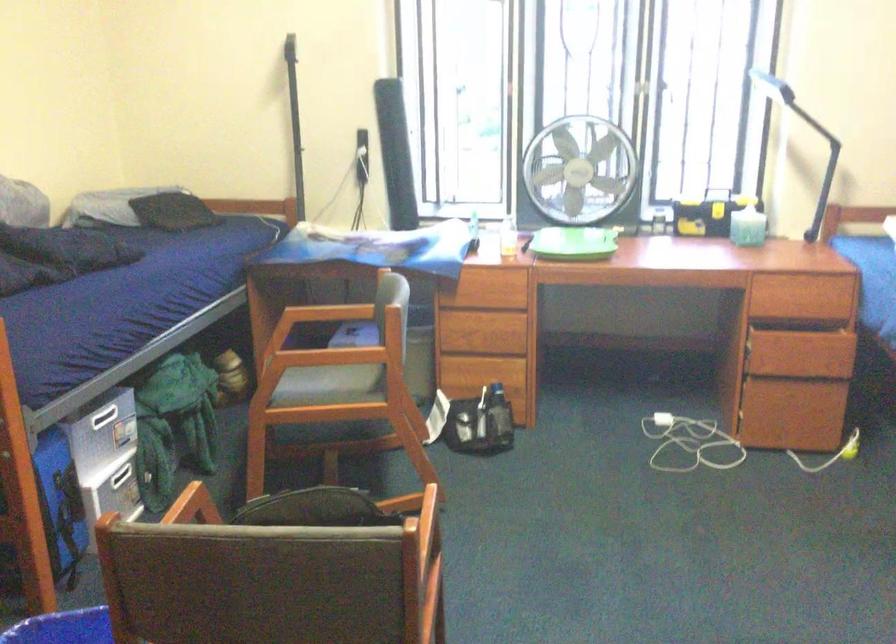
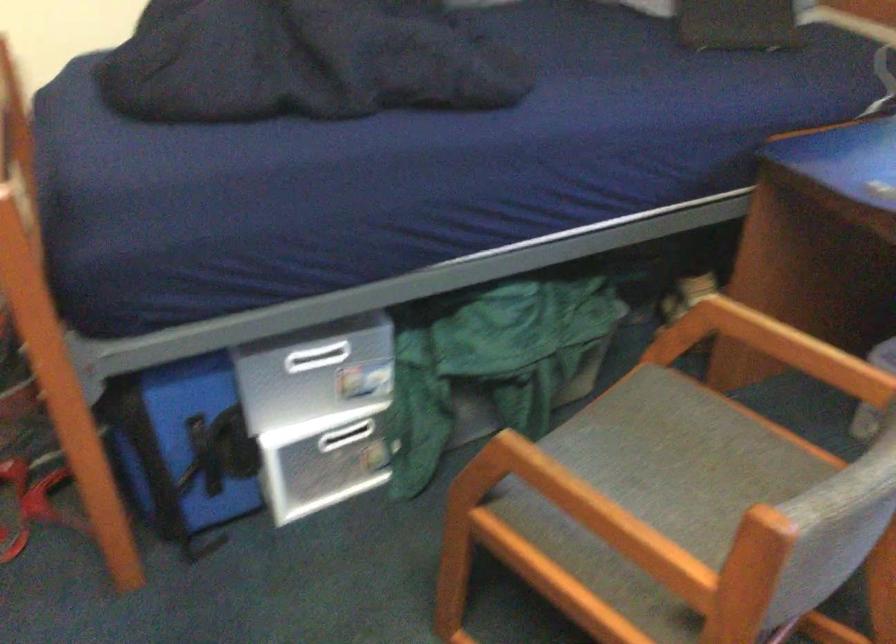
Where in the second image is the point corresponding to [307,372] from the first image?

(677, 453)